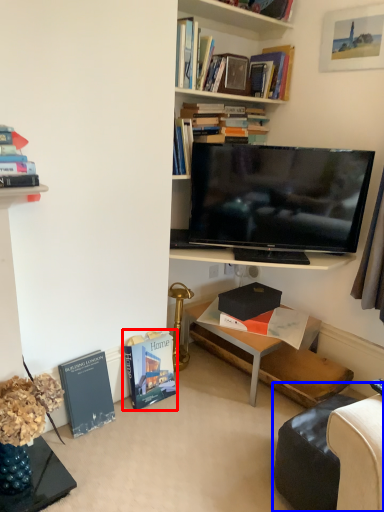
Question: Among these objects, which one is nearest to the camera, book (highlighted by a red box) or swivel chair (highlighted by a blue box)?

Choices:
 (A) book
 (B) swivel chair

Answer: (B)